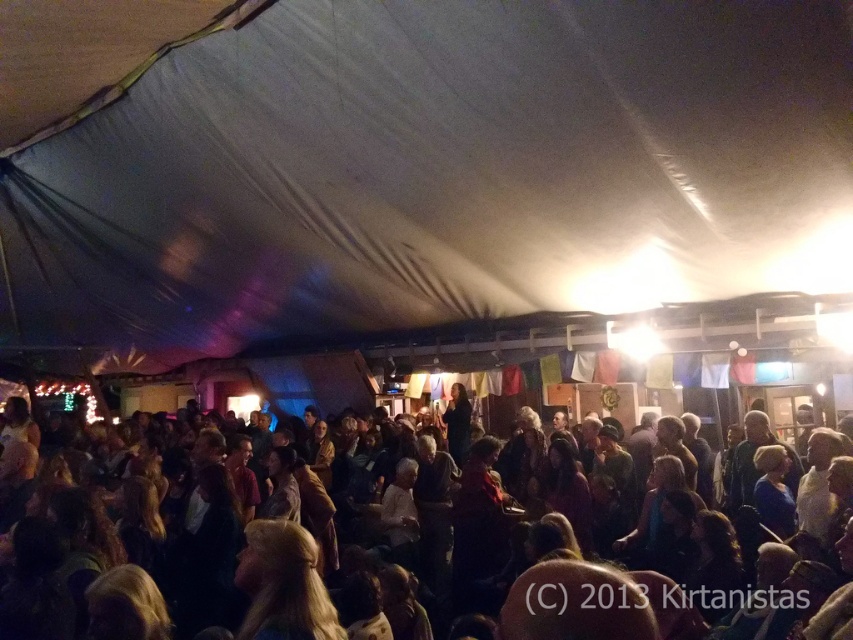
You are at the gathering and want to move from the white fabric tent at center to the dark brown hair at lower center. Which direction should you move in?

The white fabric tent at center is to the left of dark brown hair at lower center, so you should move to the right to reach the dark brown hair at lower center.

You are at a social event and need to find a place to sit. The white fabric tent at center and the dark brown hair at lower center are in your view. Which object would you estimate is physically bigger in size?

The white fabric tent at center is larger in size compared to the dark brown hair at lower center, so you can estimate that the white fabric tent at center is physically bigger.

You are planning to set up a small booth under the white fabric tent at center for an event. Considering the space occupied by the dark brown hair at lower center, will the booth fit comfortably under the tent?

The white fabric tent at center is wider than the dark brown hair at lower center, so the booth should fit comfortably under the tent as there is sufficient space.